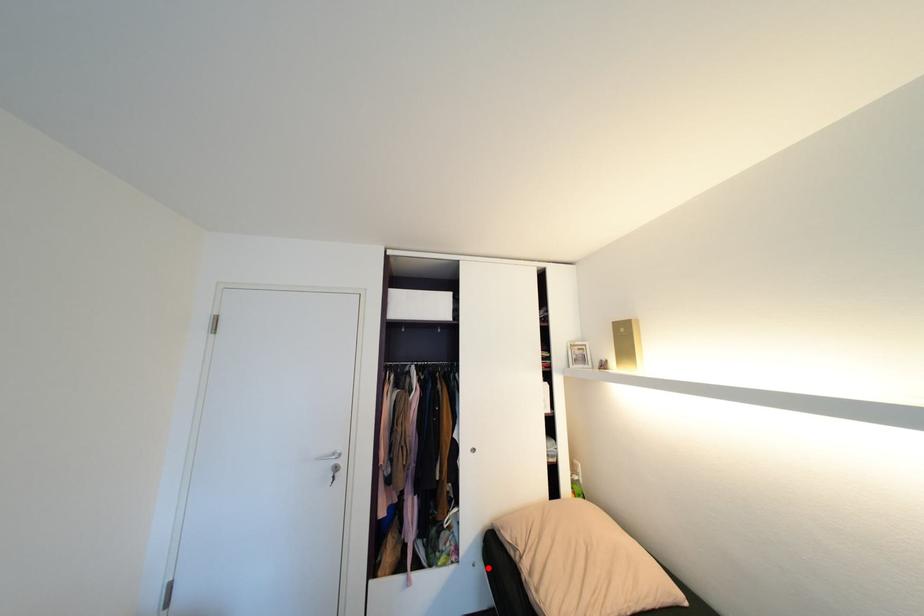
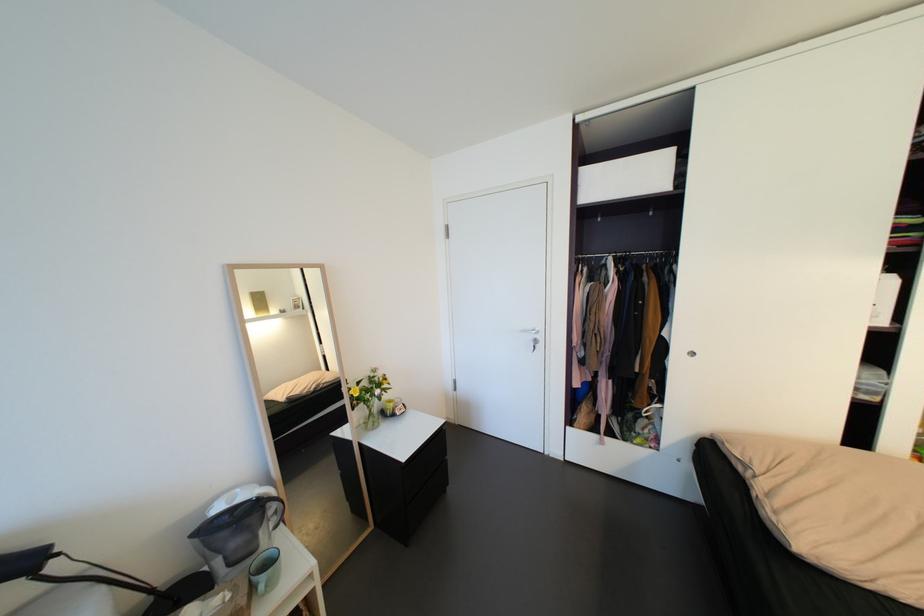
Question: I am providing you with two images of the same scene from different viewpoints. A red point is marked on the first image. At the location where the point appears in image 1, is it still visible in image 2?

Choices:
 (A) Yes
 (B) No

Answer: (A)